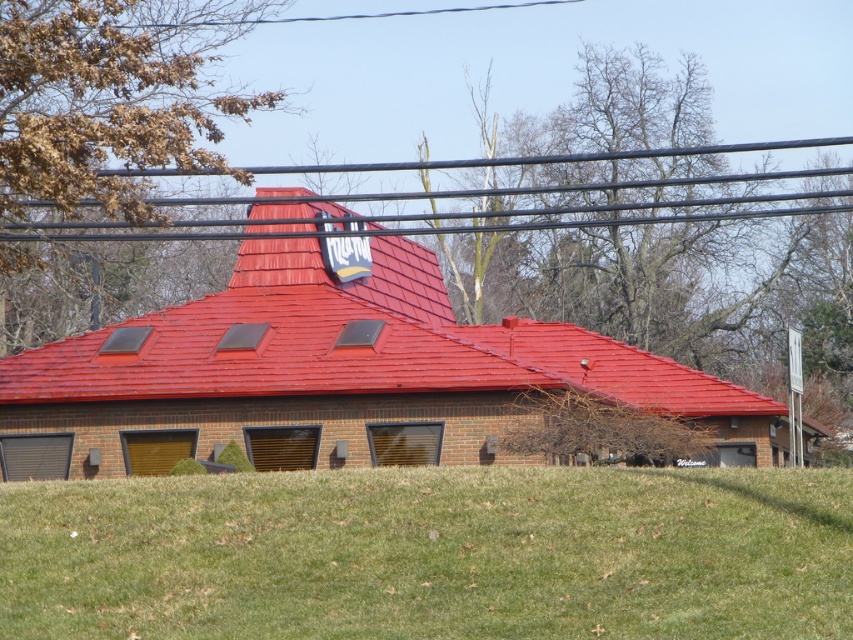
Question: Does green grass at lower center have a larger size compared to shiny red tile roof at center?

Choices:
 (A) yes
 (B) no

Answer: (B)

Question: Which point is closer to the camera taking this photo?

Choices:
 (A) (430, 492)
 (B) (584, 328)

Answer: (A)

Question: Which of the following is the farthest from the observer?

Choices:
 (A) (149, 598)
 (B) (605, 369)

Answer: (B)

Question: Among these objects, which one is farthest from the camera?

Choices:
 (A) shiny red tile roof at center
 (B) green grass at lower center

Answer: (A)

Question: Is green grass at lower center further to the viewer compared to shiny red tile roof at center?

Choices:
 (A) yes
 (B) no

Answer: (B)

Question: Can you confirm if green grass at lower center is positioned to the right of shiny red tile roof at center?

Choices:
 (A) yes
 (B) no

Answer: (A)